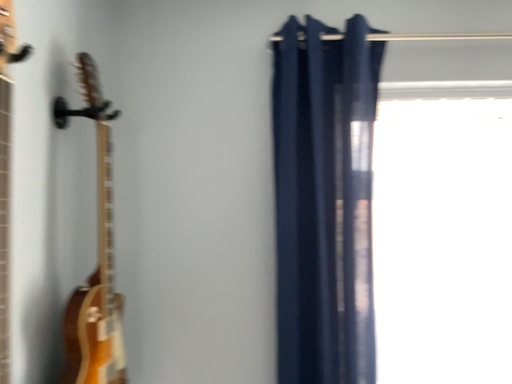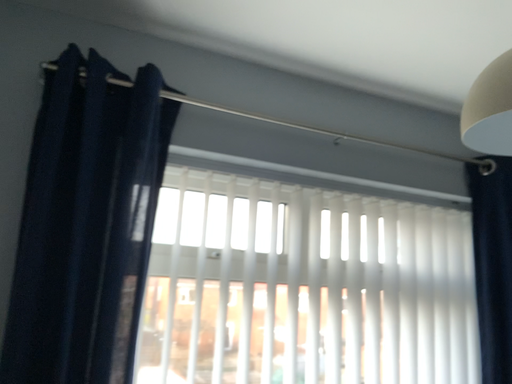
Question: How did the camera likely rotate when shooting the video?

Choices:
 (A) rotated downward
 (B) rotated upward

Answer: (B)